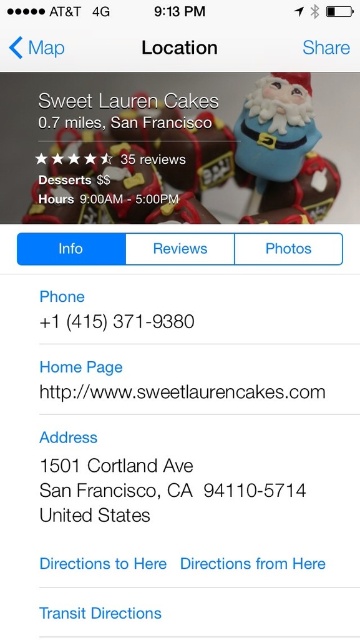
Question: Does matte blue figurine at upper right have a greater width compared to white paper address at center?

Choices:
 (A) no
 (B) yes

Answer: (A)

Question: Which object is closer to the camera taking this photo?

Choices:
 (A) matte blue figurine at upper right
 (B) white paper address at center

Answer: (B)

Question: Which point is farther to the camera?

Choices:
 (A) (206, 497)
 (B) (291, 131)

Answer: (B)

Question: Where is matte blue figurine at upper right located in relation to white paper address at center in the image?

Choices:
 (A) right
 (B) left

Answer: (A)

Question: Is matte blue figurine at upper right closer to the viewer compared to white paper address at center?

Choices:
 (A) yes
 (B) no

Answer: (B)